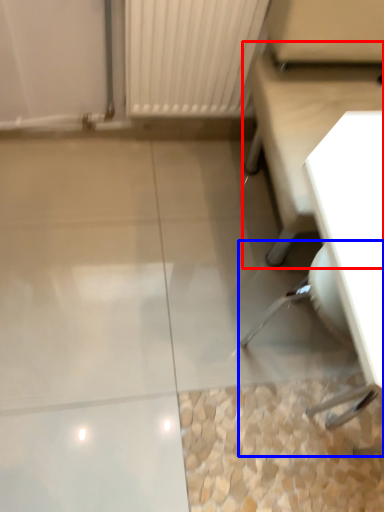
Question: Which point is closer to the camera, furniture (highlighted by a red box) or swivel chair (highlighted by a blue box)?

Choices:
 (A) furniture
 (B) swivel chair

Answer: (A)